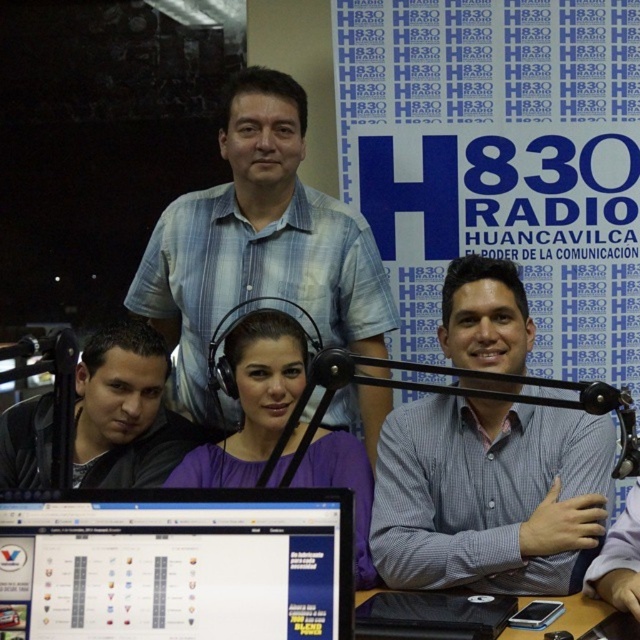
Is blue plaid shirt at center wider than metallic black microphone at right?

Correct, the width of blue plaid shirt at center exceeds that of metallic black microphone at right.

Consider the image. Does blue plaid shirt at center appear over metallic black microphone at right?

Indeed, blue plaid shirt at center is positioned over metallic black microphone at right.

Who is more distant from viewer, [336,420] or [326,388]?

Point [336,420]

Identify the location of blue plaid shirt at center. The height and width of the screenshot is (640, 640). (259, 243).

Between black leather jacket at lower left and purple matte shirt at center, which one appears on the right side from the viewer's perspective?

purple matte shirt at center

Is black leather jacket at lower left below purple matte shirt at center?

No, black leather jacket at lower left is not below purple matte shirt at center.

Find the location of a particular element. The width and height of the screenshot is (640, 640). black leather jacket at lower left is located at coordinates (125, 412).

Which of these two, matte black monitor at lower left or black plastic table at lower right, stands taller?

matte black monitor at lower left is taller.

Where is `matte black monitor at lower left`? This screenshot has width=640, height=640. matte black monitor at lower left is located at coordinates pos(177,564).

The width and height of the screenshot is (640, 640). Identify the location of matte black monitor at lower left. (177, 564).